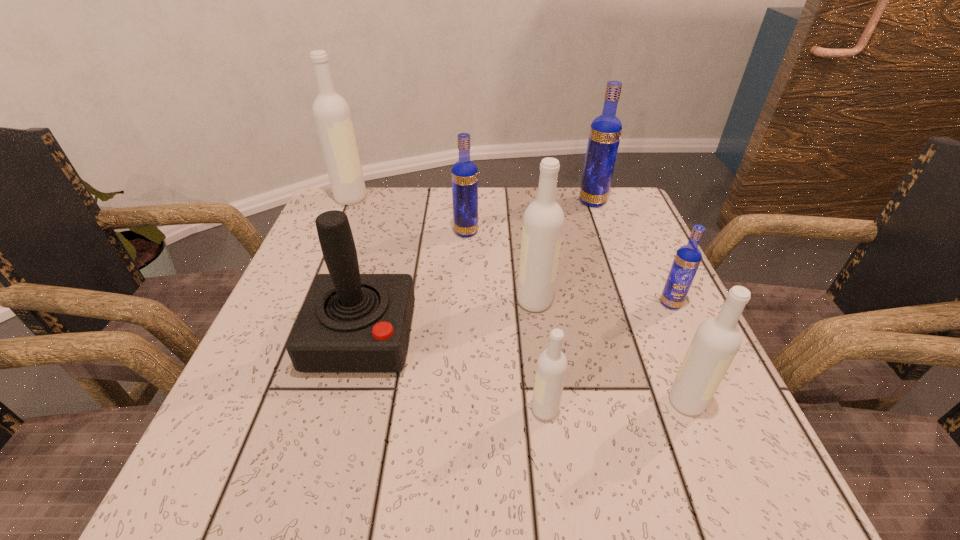
Select which vodka appears as the second closest to the biggest blue vodka. Please provide its 2D coordinates. Your answer should be formatted as a tuple, i.e. [(x, y)], where the tuple contains the x and y coordinates of a point satisfying the conditions above.

[(543, 222)]

The width and height of the screenshot is (960, 540). I want to click on the second closest white vodka relative to the smallest white vodka, so click(543, 222).

Select which white vodka appears as the third closest to the smallest white vodka. Please provide its 2D coordinates. Your answer should be formatted as a tuple, i.e. [(x, y)], where the tuple contains the x and y coordinates of a point satisfying the conditions above.

[(331, 113)]

Identify which blue vodka is located as the nearest to the second blue vodka from left to right. Please provide its 2D coordinates. Your answer should be formatted as a tuple, i.e. [(x, y)], where the tuple contains the x and y coordinates of a point satisfying the conditions above.

[(464, 174)]

The width and height of the screenshot is (960, 540). In order to click on blue vodka that stands as the second closest to the second farthest blue vodka in this screenshot , I will do `click(688, 257)`.

At what (x,y) coordinates should I click in order to perform the action: click on free space that satisfies the following two spatial constraints: 1. on the base of the rightmost white vodka; 2. on the right side of the red joystick. Please return your answer as a coordinate pair (x, y). Looking at the image, I should click on (344, 402).